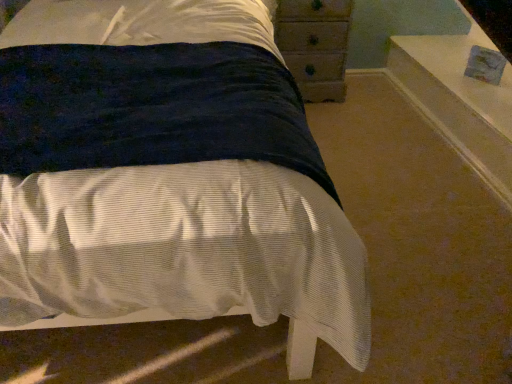
Identify the location of spots to the right of wooden chest of drawers at upper right. Image resolution: width=512 pixels, height=384 pixels. (369, 102).